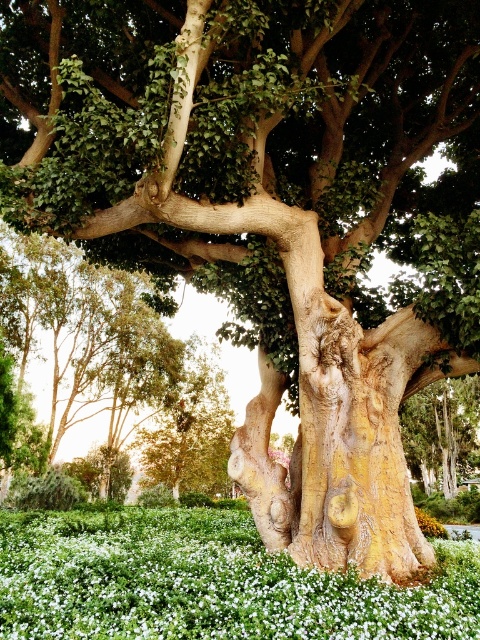
You are a gardener who wants to plant a new flower that requires more sunlight than the white matte flower at center and yellow matte flower at center. Which of the two existing flowers should you place the new flower next to, based on their height?

The white matte flower at center is not as tall as the yellow matte flower at center, so you should place the new flower next to the white matte flower at center to ensure it gets more sunlight.